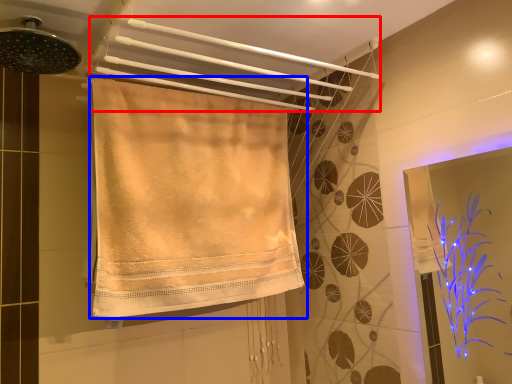
Question: Which object appears farthest to the camera in this image, towel (highlighted by a red box) or towel (highlighted by a blue box)?

Choices:
 (A) towel
 (B) towel

Answer: (B)